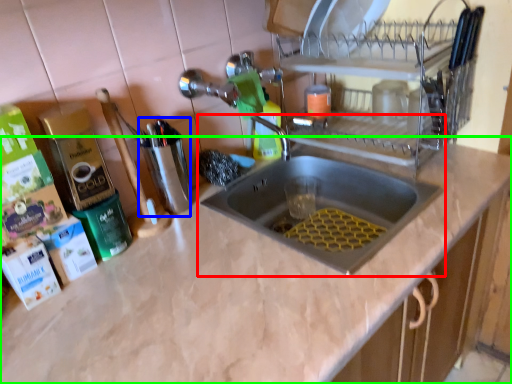
Question: Considering the real-world distances, which object is closest to sink (highlighted by a red box)? appliance (highlighted by a blue box) or countertop (highlighted by a green box).

Choices:
 (A) appliance
 (B) countertop

Answer: (B)